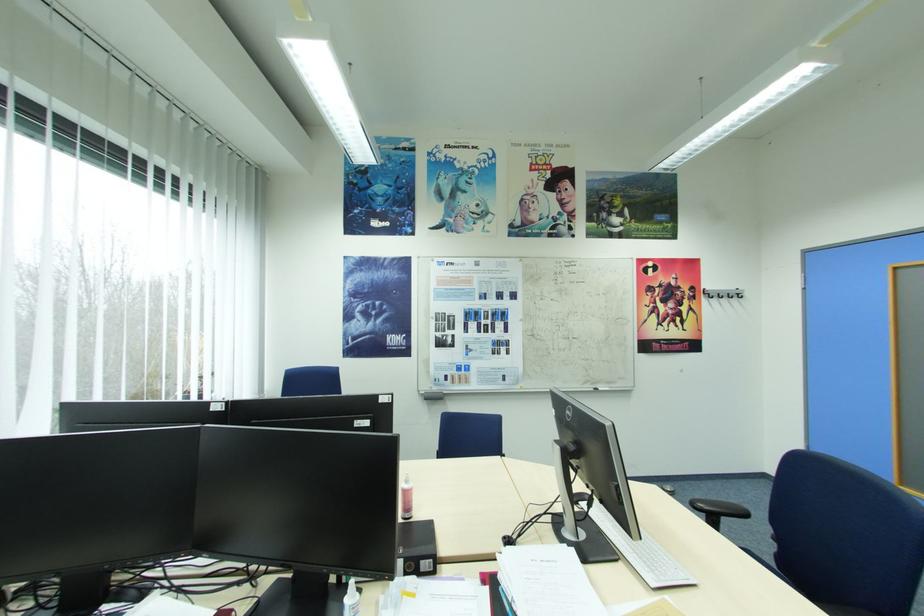
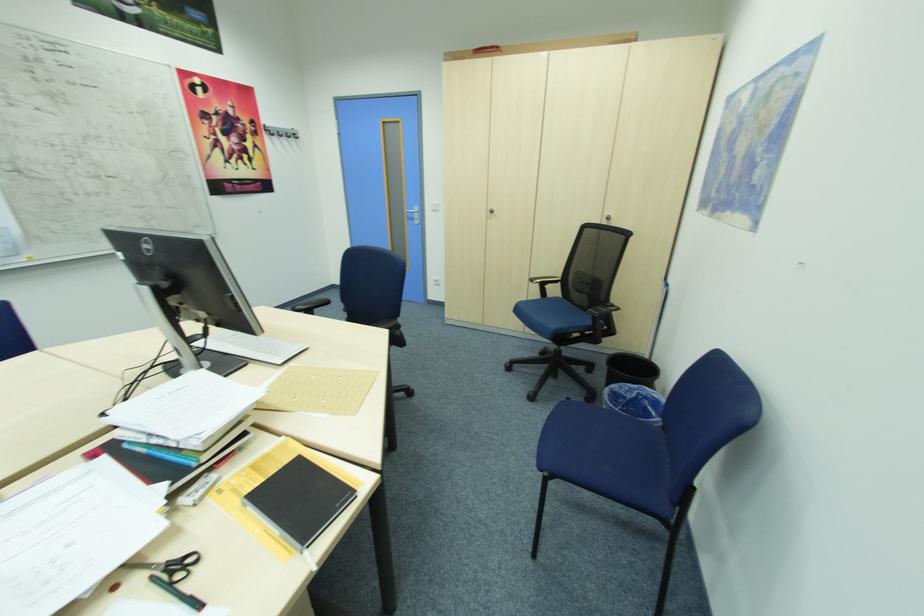
How did the camera likely rotate?

The camera rotated toward right-down.